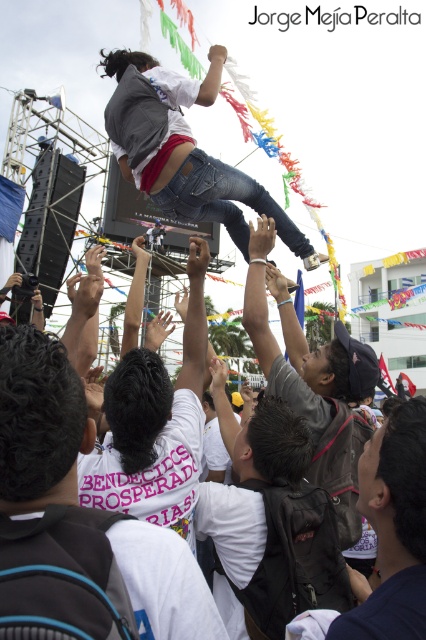
Between point (198, 333) and point (388, 429), which one is positioned behind?

Positioned behind is point (198, 333).

How much distance is there between white cotton shirt at center and dark blue shirt at lower right?

white cotton shirt at center and dark blue shirt at lower right are 18.48 meters apart.

Is point (163, 376) closer to viewer compared to point (411, 467)?

No, it is behind (411, 467).

Find the location of a particular element. white cotton shirt at center is located at coordinates (155, 426).

Is white t-shirt at center in front of dark blue shirt at lower right?

Yes.

In the scene shown: Who is more distant from viewer, (23,589) or (377,474)?

Point (377,474)

Find the location of a particular element. The height and width of the screenshot is (640, 426). white t-shirt at center is located at coordinates (77, 522).

Measure the distance between jeans at center and dark blue shirt at lower right.

A distance of 32.88 meters exists between jeans at center and dark blue shirt at lower right.

Is point (183, 205) less distant than point (405, 440)?

No, it is behind (405, 440).

Who is more distant from viewer, (134, 180) or (374, 620)?

Point (134, 180)

The width and height of the screenshot is (426, 640). I want to click on jeans at center, so click(x=184, y=150).